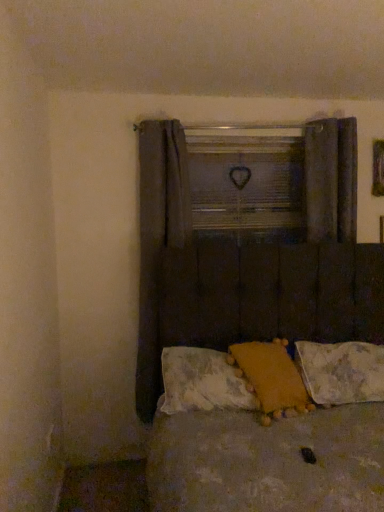
Question: From a real-world perspective, is dark fabric curtain at right, the second curtain positioned from the left, positioned over dark fabric curtain at left, the 1th curtain from the left, based on gravity?

Choices:
 (A) yes
 (B) no

Answer: (A)

Question: Considering the relative sizes of dark fabric curtain at right, the second curtain positioned from the left, and dark fabric curtain at left, which is the second curtain from right to left, in the image provided, is dark fabric curtain at right, the second curtain positioned from the left, smaller than dark fabric curtain at left, which is the second curtain from right to left,?

Choices:
 (A) no
 (B) yes

Answer: (B)

Question: Can you confirm if dark fabric curtain at right, the second curtain positioned from the left, is shorter than dark fabric curtain at left, the 1th curtain from the left?

Choices:
 (A) yes
 (B) no

Answer: (A)

Question: From a real-world perspective, is dark fabric curtain at right, the second curtain positioned from the left, below dark fabric curtain at left, which is the second curtain from right to left?

Choices:
 (A) yes
 (B) no

Answer: (B)

Question: Considering the relative positions of dark fabric curtain at right, the second curtain positioned from the left, and dark fabric curtain at left, the 1th curtain from the left, in the image provided, is dark fabric curtain at right, the second curtain positioned from the left, to the right of dark fabric curtain at left, the 1th curtain from the left, from the viewer's perspective?

Choices:
 (A) no
 (B) yes

Answer: (B)

Question: From the image's perspective, is fluffy yellow pillow at center, which ranks as the first pillow in left-to-right order, positioned above or below fluffy white pillow at lower right, which appears as the 3th pillow when viewed from the left?

Choices:
 (A) above
 (B) below

Answer: (A)

Question: Considering the positions of fluffy yellow pillow at center, placed as the 3th pillow when sorted from right to left, and fluffy white pillow at lower right, which is counted as the first pillow, starting from the right, in the image, is fluffy yellow pillow at center, placed as the 3th pillow when sorted from right to left, wider or thinner than fluffy white pillow at lower right, which is counted as the first pillow, starting from the right,?

Choices:
 (A) thin
 (B) wide

Answer: (A)

Question: Considering their positions, is fluffy yellow pillow at center, which ranks as the first pillow in left-to-right order, located in front of or behind fluffy white pillow at lower right, which is counted as the first pillow, starting from the right?

Choices:
 (A) front
 (B) behind

Answer: (A)

Question: Considering the positions of point (201, 394) and point (314, 393), is point (201, 394) closer or farther from the camera than point (314, 393)?

Choices:
 (A) closer
 (B) farther

Answer: (A)

Question: Looking at their shapes, would you say fluffy white pillow at lower right, which is counted as the first pillow, starting from the right, is wider or thinner than fluffy yellow pillow at center, placed as the 3th pillow when sorted from right to left?

Choices:
 (A) thin
 (B) wide

Answer: (B)

Question: In the image, is fluffy white pillow at lower right, which appears as the 3th pillow when viewed from the left, positioned in front of or behind fluffy yellow pillow at center, placed as the 3th pillow when sorted from right to left?

Choices:
 (A) front
 (B) behind

Answer: (B)

Question: Is fluffy white pillow at lower right, which appears as the 3th pillow when viewed from the left, taller or shorter than fluffy yellow pillow at center, which ranks as the first pillow in left-to-right order?

Choices:
 (A) short
 (B) tall

Answer: (B)

Question: Visually, is fluffy white pillow at lower right, which is counted as the first pillow, starting from the right, positioned to the left or to the right of fluffy yellow pillow at center, placed as the 3th pillow when sorted from right to left?

Choices:
 (A) right
 (B) left

Answer: (A)

Question: Is brown tufted headboard at center taller or shorter than dark fabric curtain at right, the second curtain positioned from the left?

Choices:
 (A) short
 (B) tall

Answer: (B)

Question: From the image's perspective, is brown tufted headboard at center above or below dark fabric curtain at right, the second curtain positioned from the left?

Choices:
 (A) above
 (B) below

Answer: (B)